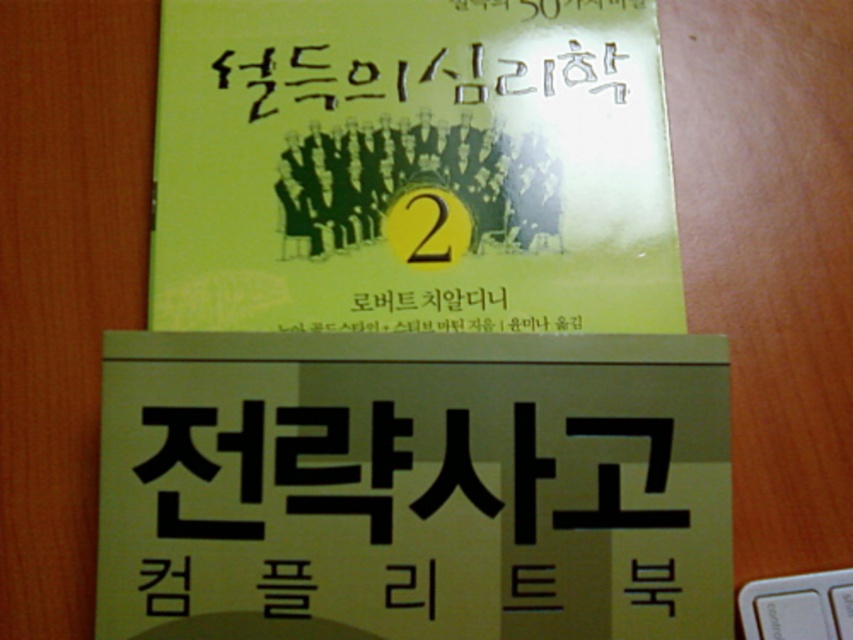
Question: Does green matte book at center appear over black handwritten text at center?

Choices:
 (A) yes
 (B) no

Answer: (B)

Question: Which point is farther to the camera?

Choices:
 (A) (589, 67)
 (B) (752, 588)

Answer: (A)

Question: Is yellow paper sign at center wider than white plastic keyboard at lower right?

Choices:
 (A) yes
 (B) no

Answer: (A)

Question: Which point appears farthest from the camera in this image?

Choices:
 (A) (531, 84)
 (B) (757, 579)
 (C) (357, 284)

Answer: (A)

Question: Does yellow paper sign at center appear on the left side of green matte book at center?

Choices:
 (A) no
 (B) yes

Answer: (A)

Question: Which point appears closest to the camera in this image?

Choices:
 (A) (144, 364)
 (B) (802, 593)
 (C) (321, 52)

Answer: (A)